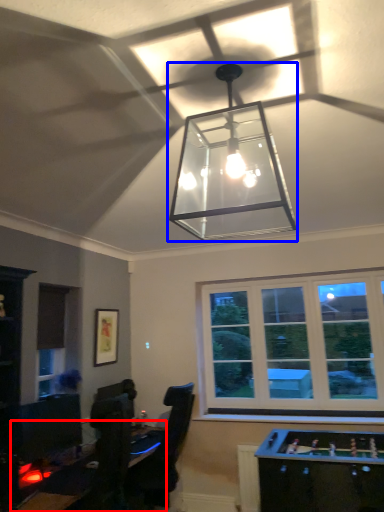
Question: Which of the following is the closest to the observer, table (highlighted by a red box) or lamp (highlighted by a blue box)?

Choices:
 (A) table
 (B) lamp

Answer: (B)